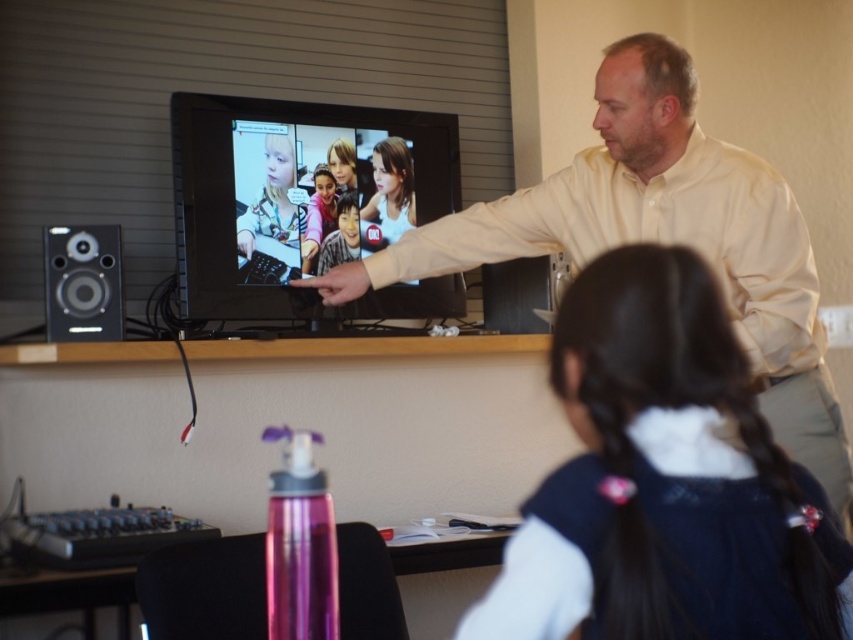
You are a photographer trying to capture a clear shot of both the black silky hair at upper center and the matte yellow shirt at upper right. Since you can only focus on one subject at a time, which one should you focus on to ensure the other is still in the frame?

The black silky hair at upper center is positioned on the left side of matte yellow shirt at upper right. Therefore, focusing on the matte yellow shirt at upper right would keep the black silky hair at upper center within the frame since it is to the left of it.

You are a photographer trying to capture a clear shot of both the black silky hair at upper center and the matte black speaker at left. Which object should you focus on first to ensure both are in focus?

You should focus on the black silky hair at upper center first because it is closer to the viewer than the matte black speaker at left, allowing the camera to adjust focus starting from the nearest object.